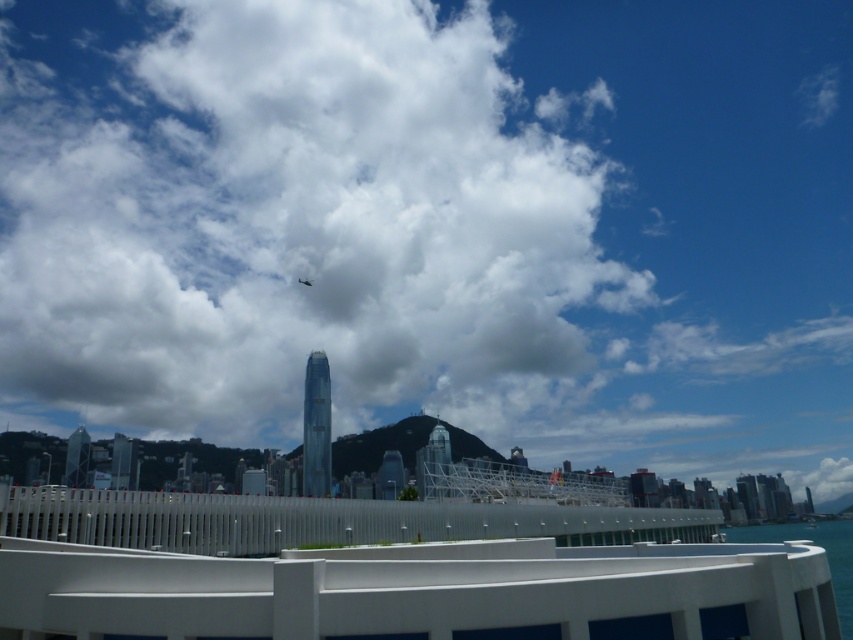
Question: Which point is farther from the camera taking this photo?

Choices:
 (A) (605, 525)
 (B) (833, 540)

Answer: (B)

Question: Considering the real-world distances, which object is farthest from the white fluffy cloud at upper center?

Choices:
 (A) blue water at lower right
 (B) silver metallic rail at center

Answer: (B)

Question: Can you confirm if silver metallic rail at center is smaller than blue water at lower right?

Choices:
 (A) no
 (B) yes

Answer: (B)

Question: Which of the following is the closest to the observer?

Choices:
 (A) white fluffy cloud at upper center
 (B) blue water at lower right
 (C) silver metallic rail at center

Answer: (B)

Question: Does white fluffy cloud at upper center lie in front of silver metallic rail at center?

Choices:
 (A) no
 (B) yes

Answer: (A)

Question: Does silver metallic rail at center appear on the right side of blue water at lower right?

Choices:
 (A) no
 (B) yes

Answer: (A)